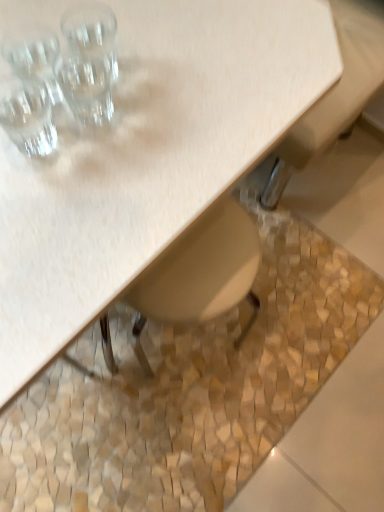
You are a GUI agent. You are given a task and a screenshot of the screen. Output one action in this format:
    pyautogui.click(x=<x>, y=<y>)
    Task: Click on the free point to the left of transparent glass at upper left, which is the 1th shot glass in top-to-bottom order
    This screenshot has height=512, width=384.
    Given the screenshot: What is the action you would take?
    pyautogui.click(x=31, y=58)